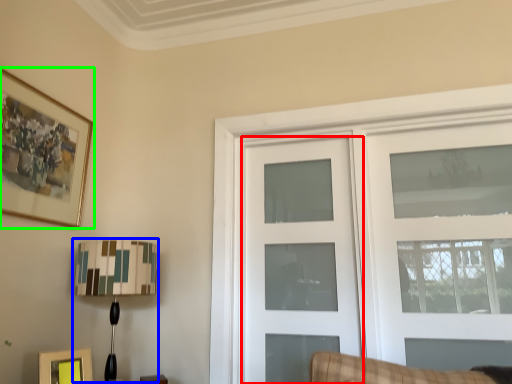
Question: Which object is the farthest from door (highlighted by a red box)? Choose among these: table lamp (highlighted by a blue box) or picture frame (highlighted by a green box).

Choices:
 (A) table lamp
 (B) picture frame

Answer: (B)